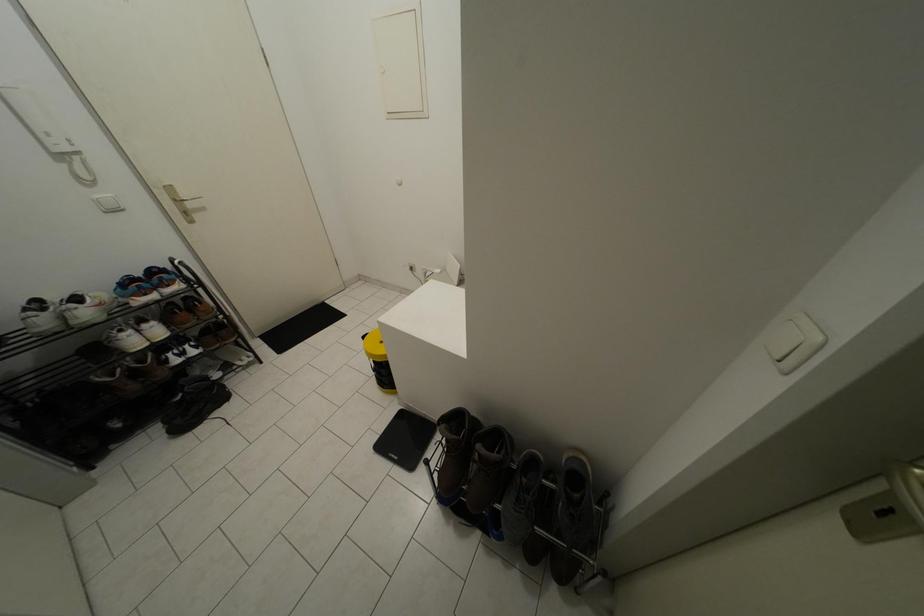
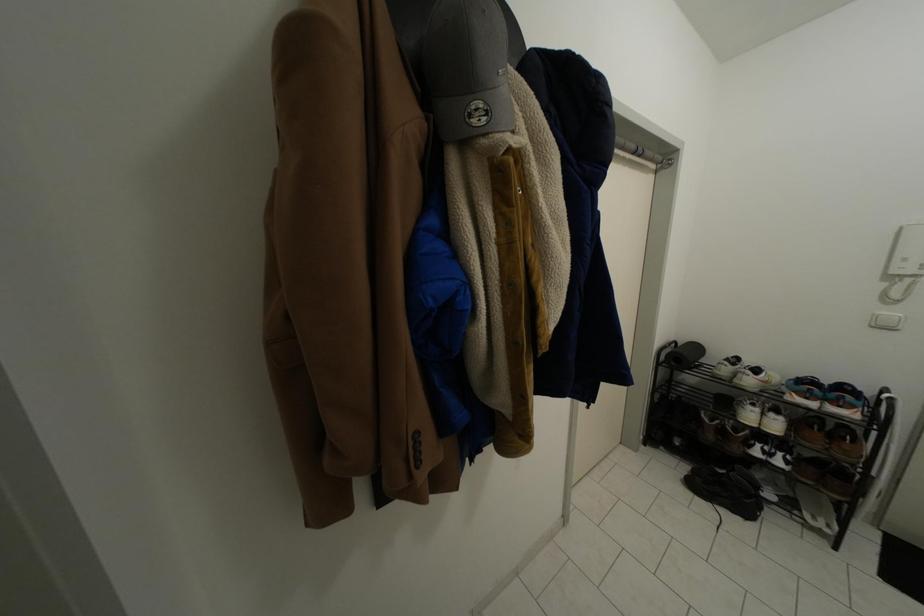
Based on the continuous images, in which direction is the camera rotating?

The camera rotated toward left-down.